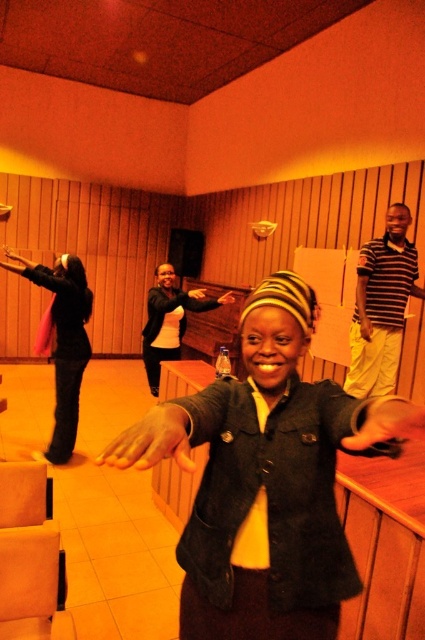
You are a photographer trying to capture a candid shot of the denim jacket at center and the matte black jacket at left. Since the lighting is dim, you need to adjust your camera settings. Which jacket should you focus on first to ensure proper exposure?

The denim jacket at center is located below the matte black jacket at left, so focusing on the matte black jacket at left first would be better because it is higher up and might be in a brighter area of the scene.

You are organizing a clothing donation drive and need to determine if the denim jacket at center and the matte black jacket at left can fit into a standard donation box that measures 20 inches in length. Based on their sizes, will both jackets fit?

The denim jacket at center is smaller than the matte black jacket at left. Since the standard donation box is 20 inches long, both jackets should fit as long as their combined length does not exceed the box size. However, if they are placed individually, the larger matte black jacket at left might not fit if its length exceeds 20 inches. More information about each jacket size is needed to confirm.

You are a fashion designer observing the scene and want to create a new jacket design that balances the lengths of the denim jacket at center and the matte black jacket at left. Which jacket should you use as the base for your design to achieve the desired balance?

The denim jacket at center is shorter than the matte black jacket at left, so to balance their lengths, you should use the matte black jacket at left as the base and shorten it slightly to match the denim jacket at center, or lengthen the denim jacket at center to meet the matte black jacket at left.